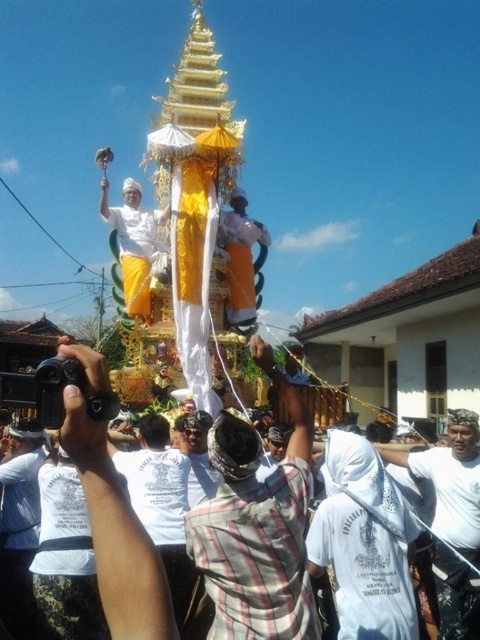
Is plaid shirt at center to the right of white woven cloth at center from the viewer's perspective?

No, plaid shirt at center is not to the right of white woven cloth at center.

Does point (272, 636) come closer to viewer compared to point (436, 506)?

That is True.

The height and width of the screenshot is (640, 480). In order to click on plaid shirt at center in this screenshot , I will do click(x=256, y=528).